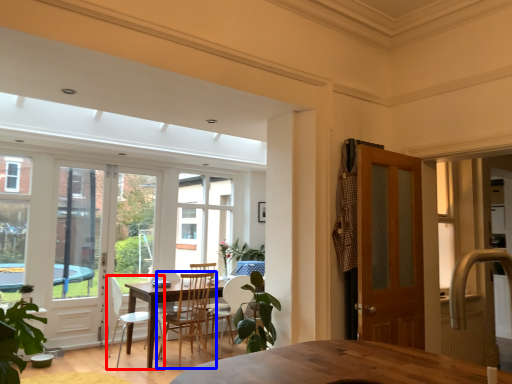
Question: Which of the following is the closest to the observer, chair (highlighted by a red box) or chair (highlighted by a blue box)?

Choices:
 (A) chair
 (B) chair

Answer: (A)